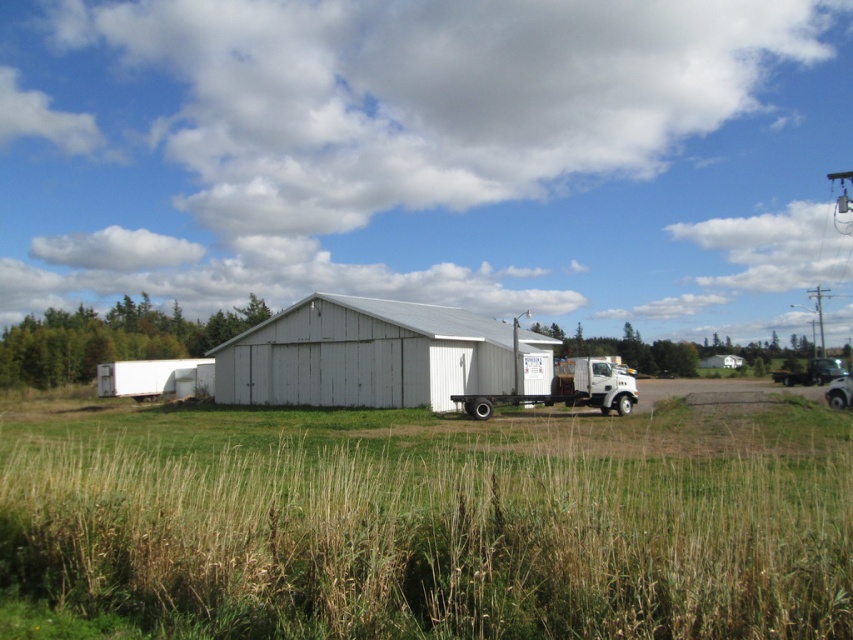
Which is below, white matte barn at center or white matte trailer truck at center?

white matte trailer truck at center is below.

Between white matte barn at center and white matte trailer truck at center, which one has less height?

Standing shorter between the two is white matte trailer truck at center.

Find the location of a particular element. white matte barn at center is located at coordinates (363, 355).

Is point (792, 620) behind point (619, 412)?

No.

Based on the photo, which is more to the right, green grass at center or white matte trailer truck at center?

From the viewer's perspective, white matte trailer truck at center appears more on the right side.

Is point (189, 433) closer to camera compared to point (575, 392)?

Yes, point (189, 433) is in front of point (575, 392).

The height and width of the screenshot is (640, 853). In order to click on green grass at center in this screenshot , I will do `click(440, 524)`.

Who is lower down, green grass at center or white matte barn at center?

green grass at center

Is green grass at center to the right of white matte barn at center from the viewer's perspective?

Incorrect, green grass at center is not on the right side of white matte barn at center.

What do you see at coordinates (440, 524) in the screenshot?
I see `green grass at center` at bounding box center [440, 524].

The image size is (853, 640). I want to click on green grass at center, so click(x=440, y=524).